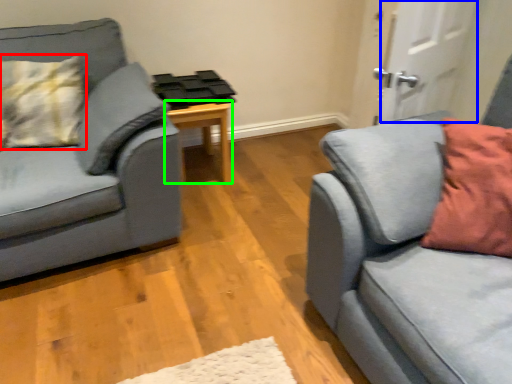
Question: Estimate the real-world distances between objects in this image. Which object is farther from pillow (highlighted by a red box), door (highlighted by a blue box) or table (highlighted by a green box)?

Choices:
 (A) door
 (B) table

Answer: (A)